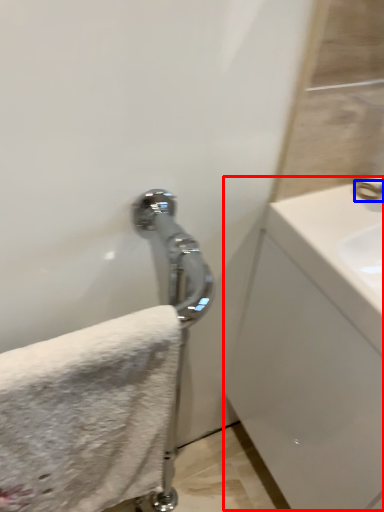
Question: Among these objects, which one is farthest to the camera, counter top (highlighted by a red box) or faucet (highlighted by a blue box)?

Choices:
 (A) counter top
 (B) faucet

Answer: (B)